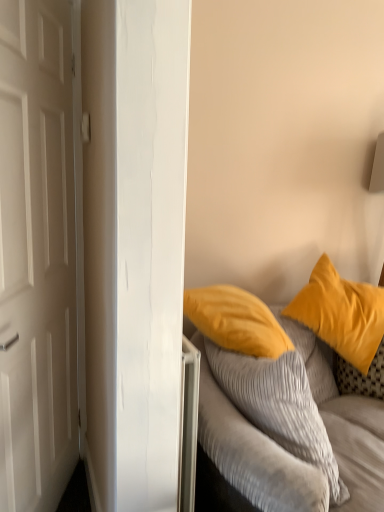
Question: Does soft yellow pillow at right appear on the left side of white matte door at left?

Choices:
 (A) yes
 (B) no

Answer: (B)

Question: Is soft yellow pillow at right taller than white matte door at left?

Choices:
 (A) yes
 (B) no

Answer: (B)

Question: Is white matte door at left located within soft yellow pillow at right?

Choices:
 (A) no
 (B) yes

Answer: (A)

Question: From a real-world perspective, is soft yellow pillow at right physically below white matte door at left?

Choices:
 (A) no
 (B) yes

Answer: (B)

Question: From a real-world perspective, is soft yellow pillow at right located higher than white matte door at left?

Choices:
 (A) no
 (B) yes

Answer: (A)

Question: Is soft yellow pillow at right wider or thinner than white matte door at left?

Choices:
 (A) thin
 (B) wide

Answer: (B)

Question: Is soft yellow pillow at right situated inside white matte door at left or outside?

Choices:
 (A) outside
 (B) inside

Answer: (A)

Question: In the image, is soft yellow pillow at right on the left side or the right side of white matte door at left?

Choices:
 (A) right
 (B) left

Answer: (A)

Question: Relative to white matte door at left, is soft yellow pillow at right in front or behind?

Choices:
 (A) behind
 (B) front

Answer: (A)

Question: From a real-world perspective, is white matte door at left above or below soft yellow pillow at right?

Choices:
 (A) below
 (B) above

Answer: (B)

Question: In terms of height, does white matte door at left look taller or shorter compared to soft yellow pillow at right?

Choices:
 (A) tall
 (B) short

Answer: (A)

Question: Based on their sizes in the image, would you say white matte door at left is bigger or smaller than soft yellow pillow at right?

Choices:
 (A) big
 (B) small

Answer: (A)

Question: Looking at their shapes, would you say white matte door at left is wider or thinner than soft yellow pillow at right?

Choices:
 (A) wide
 (B) thin

Answer: (B)

Question: Considering the positions of point (329, 312) and point (9, 17), is point (329, 312) closer or farther from the camera than point (9, 17)?

Choices:
 (A) farther
 (B) closer

Answer: (A)

Question: From the image's perspective, is matte yellow pillow at upper right positioned above or below white matte door at left?

Choices:
 (A) below
 (B) above

Answer: (A)